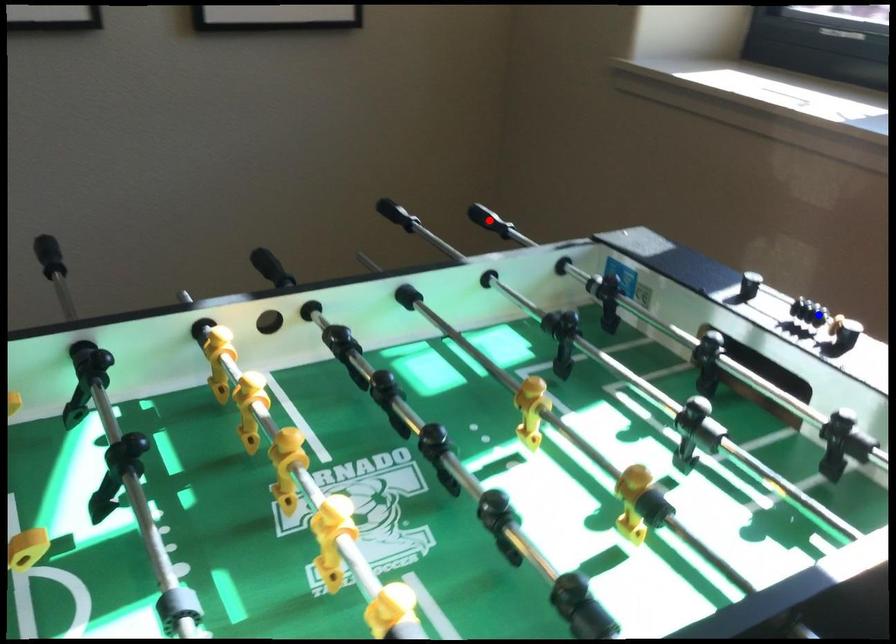
Question: In the image, two points are highlighted. Which point is nearer to the camera? Reply with the corresponding letter.

Choices:
 (A) blue point
 (B) red point

Answer: (A)